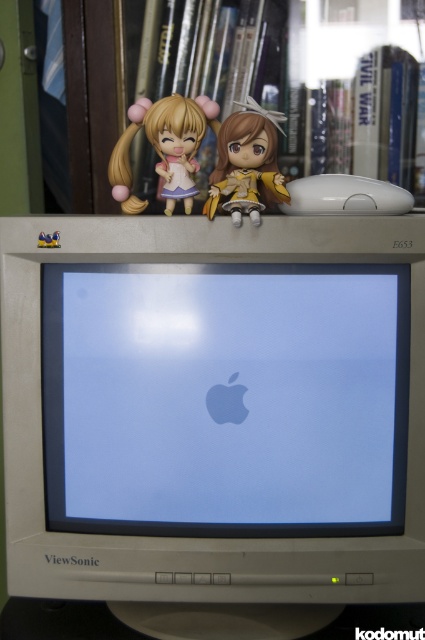
Between point (57, 276) and point (249, 136), which one is positioned behind?

Positioned behind is point (249, 136).

The width and height of the screenshot is (425, 640). What do you see at coordinates (215, 417) in the screenshot?
I see `beige plastic monitor at center` at bounding box center [215, 417].

Who is more distant from viewer, [294,449] or [272,180]?

Point [294,449]

Image resolution: width=425 pixels, height=640 pixels. What are the coordinates of `beige plastic monitor at center` in the screenshot? It's located at (215, 417).

Does beige plastic monitor at center have a greater width compared to matte plastic figurine at upper center?

Yes, beige plastic monitor at center is wider than matte plastic figurine at upper center.

Between point (325, 564) and point (187, 211), which one is positioned in front?

Point (325, 564) is more forward.

Image resolution: width=425 pixels, height=640 pixels. Describe the element at coordinates (215, 417) in the screenshot. I see `beige plastic monitor at center` at that location.

Find the location of a particular element. beige plastic monitor at center is located at coordinates (215, 417).

Between point (255, 129) and point (195, 106), which one is positioned in front?

Positioned in front is point (255, 129).

Between matte yellow doll at center and matte plastic figurine at upper center, which one is positioned higher?

matte plastic figurine at upper center is above.

Is point (232, 125) positioned before point (181, 145)?

Yes, point (232, 125) is closer to viewer.

The height and width of the screenshot is (640, 425). Find the location of `matte yellow doll at center`. matte yellow doll at center is located at coordinates (246, 163).